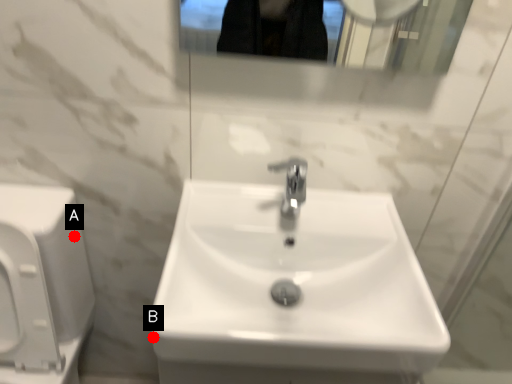
Question: Two points are circled on the image, labeled by A and B beside each circle. Which point is farther to the camera?

Choices:
 (A) A is further
 (B) B is further

Answer: (A)